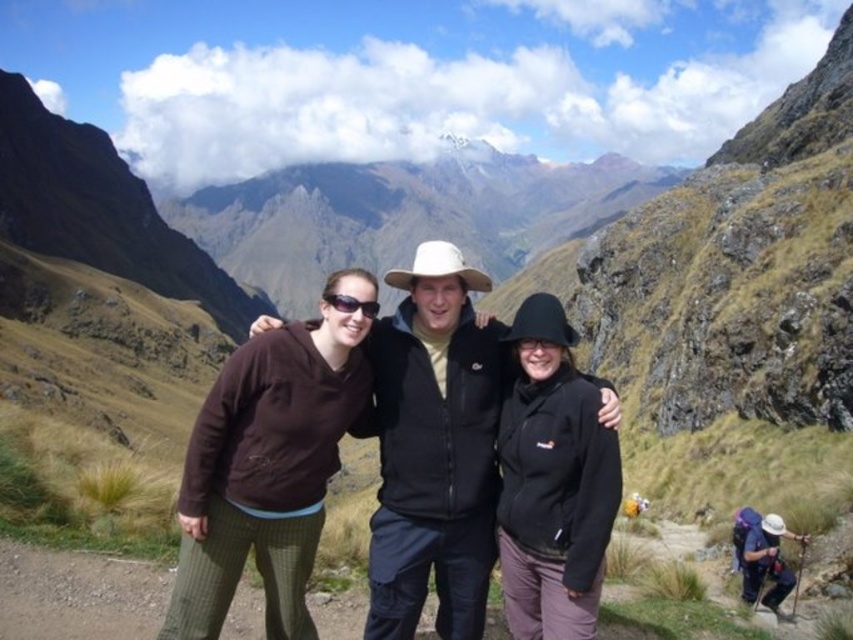
Question: Which of the following is the closest to the observer?

Choices:
 (A) black fleece jacket at center
 (B) matte black jacket at center

Answer: (B)

Question: Is matte black jacket at center thinner than black matte sunglasses at center?

Choices:
 (A) yes
 (B) no

Answer: (B)

Question: Which point appears farthest from the camera in this image?

Choices:
 (A) (242, 506)
 (B) (556, 628)
 (C) (366, 307)
 (D) (395, 342)

Answer: (D)

Question: Which point is closer to the camera taking this photo?

Choices:
 (A) (434, 563)
 (B) (265, 349)
 (C) (334, 292)
 (D) (543, 467)

Answer: (D)

Question: Is matte black jacket at center to the right of black matte sunglasses at center from the viewer's perspective?

Choices:
 (A) no
 (B) yes

Answer: (B)

Question: Is brown fleece at center above black matte sunglasses at center?

Choices:
 (A) yes
 (B) no

Answer: (B)